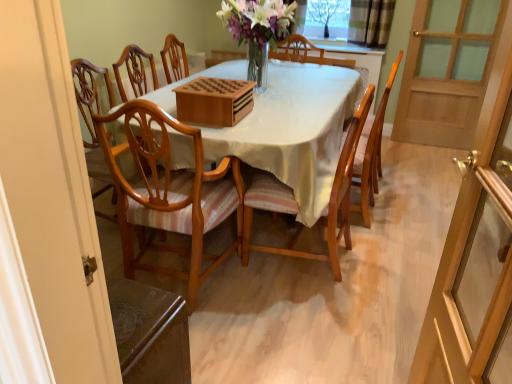
You are a GUI agent. You are given a task and a screenshot of the screen. Output one action in this format:
    pyautogui.click(x=<x>, y=<y>)
    Task: Click on the vacant region under translucent glass vase at center (from a real-world perspective)
    
    Given the screenshot: What is the action you would take?
    pyautogui.click(x=273, y=91)